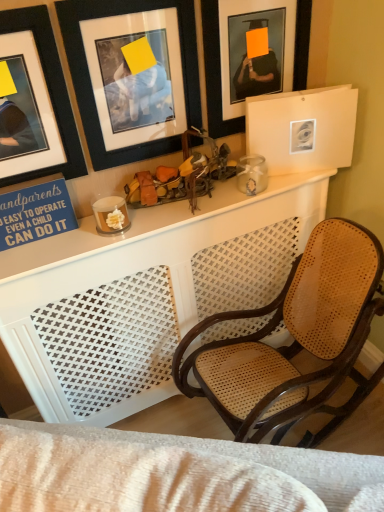
Question: Does matte black picture frame at upper center, the first picture frame in the right-to-left sequence, come in front of black matte picture frame at upper left, acting as the 1th picture frame starting from the left?

Choices:
 (A) yes
 (B) no

Answer: (B)

Question: Considering the relative sizes of matte black picture frame at upper center, the first picture frame in the right-to-left sequence, and black matte picture frame at upper left, acting as the 1th picture frame starting from the left, in the image provided, is matte black picture frame at upper center, the first picture frame in the right-to-left sequence, thinner than black matte picture frame at upper left, acting as the 1th picture frame starting from the left,?

Choices:
 (A) no
 (B) yes

Answer: (B)

Question: Is matte black picture frame at upper center, the first picture frame in the right-to-left sequence, positioned with its back to black matte picture frame at upper left, the 3th picture frame in the right-to-left sequence?

Choices:
 (A) no
 (B) yes

Answer: (A)

Question: Is matte black picture frame at upper center, which appears as the third picture frame when viewed from the left, located outside black matte picture frame at upper left, the 3th picture frame in the right-to-left sequence?

Choices:
 (A) no
 (B) yes

Answer: (B)

Question: Is matte black picture frame at upper center, the first picture frame in the right-to-left sequence, at the right side of black matte picture frame at upper left, acting as the 1th picture frame starting from the left?

Choices:
 (A) yes
 (B) no

Answer: (A)

Question: From a real-world perspective, is black matte picture frame at upper left, which appears as the second picture frame when viewed from the left, physically located above or below matte black picture frame at upper center, which appears as the third picture frame when viewed from the left?

Choices:
 (A) above
 (B) below

Answer: (B)

Question: In terms of height, does black matte picture frame at upper left, which is the 2th picture frame in right-to-left order, look taller or shorter compared to matte black picture frame at upper center, the first picture frame in the right-to-left sequence?

Choices:
 (A) tall
 (B) short

Answer: (B)

Question: Is point (195, 108) positioned closer to the camera than point (213, 32)?

Choices:
 (A) farther
 (B) closer

Answer: (A)

Question: Is black matte picture frame at upper left, which is the 2th picture frame in right-to-left order, in front of or behind matte black picture frame at upper center, which appears as the third picture frame when viewed from the left, in the image?

Choices:
 (A) behind
 (B) front

Answer: (B)

Question: Is point (x=215, y=39) closer or farther from the camera than point (x=87, y=71)?

Choices:
 (A) farther
 (B) closer

Answer: (A)

Question: From a real-world perspective, is matte black picture frame at upper center, which appears as the third picture frame when viewed from the left, above or below black matte picture frame at upper left, which appears as the second picture frame when viewed from the left?

Choices:
 (A) above
 (B) below

Answer: (A)

Question: From their relative heights in the image, would you say matte black picture frame at upper center, which appears as the third picture frame when viewed from the left, is taller or shorter than black matte picture frame at upper left, which appears as the second picture frame when viewed from the left?

Choices:
 (A) short
 (B) tall

Answer: (A)

Question: Considering their positions, is matte black picture frame at upper center, the first picture frame in the right-to-left sequence, located in front of or behind black matte picture frame at upper left, which is the 2th picture frame in right-to-left order?

Choices:
 (A) behind
 (B) front

Answer: (A)

Question: In the image, is matte black picture frame at upper center, the first picture frame in the right-to-left sequence, on the left side or the right side of black matte picture frame at upper left, the 3th picture frame in the right-to-left sequence?

Choices:
 (A) left
 (B) right

Answer: (B)

Question: From the image's perspective, is matte black picture frame at upper center, the first picture frame in the right-to-left sequence, located above or below black matte picture frame at upper left, the 3th picture frame in the right-to-left sequence?

Choices:
 (A) above
 (B) below

Answer: (A)